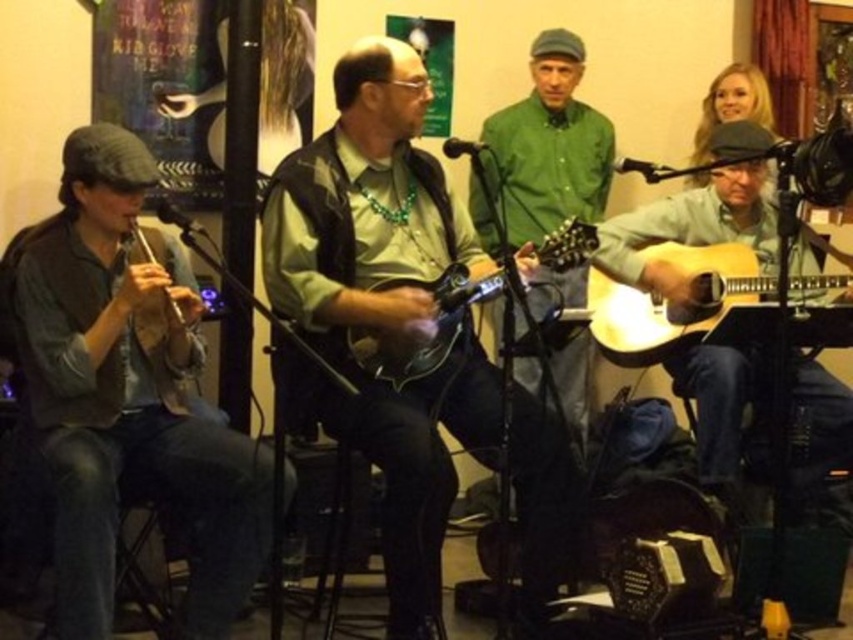
Question: Can you confirm if light brown wood guitar at right is bigger than light wood acoustic guitar at right?

Choices:
 (A) no
 (B) yes

Answer: (B)

Question: Which of the following is the closest to the observer?

Choices:
 (A) (469, 301)
 (B) (144, 252)
 (C) (653, 262)

Answer: (B)

Question: Is light brown wood guitar at right wider than light wood acoustic guitar at right?

Choices:
 (A) yes
 (B) no

Answer: (A)

Question: Which point is closer to the camera?

Choices:
 (A) (541, 477)
 (B) (177, 307)

Answer: (B)

Question: Which point is closer to the camera taking this photo?

Choices:
 (A) (425, 512)
 (B) (138, 243)
 (C) (799, 388)

Answer: (A)

Question: Does matte black mandolin at center have a smaller size compared to matte wood flute at left?

Choices:
 (A) yes
 (B) no

Answer: (B)